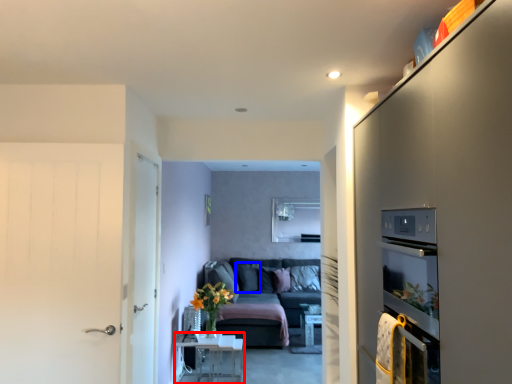
Question: Which of the following is the closest to the observer, table (highlighted by a red box) or pillow (highlighted by a blue box)?

Choices:
 (A) table
 (B) pillow

Answer: (A)